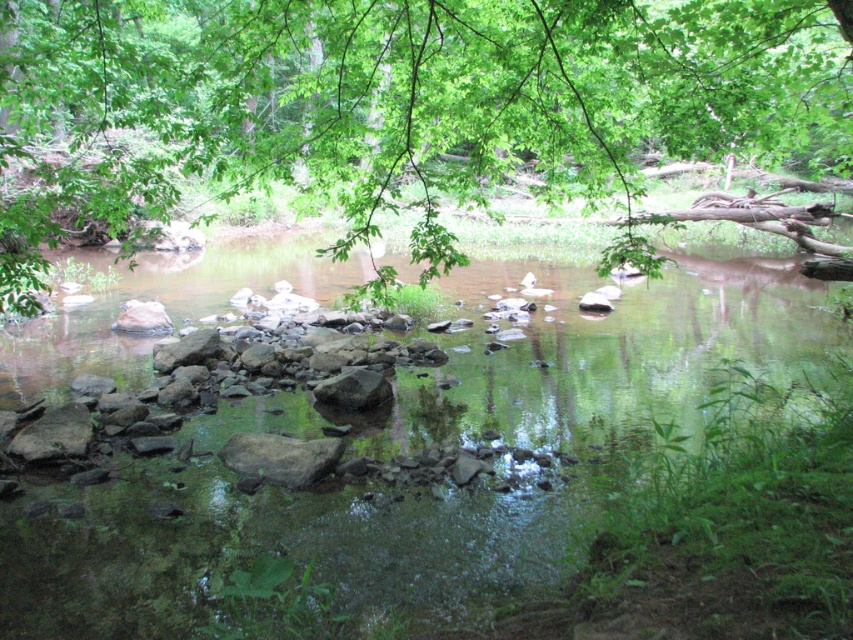
From the picture: You are a hiker standing at the edge of the stream. You notice a green leafy branch at upper center and a smooth gray rock at center. Which object is closer to you?

The smooth gray rock at center is closer to you since the green leafy branch at upper center is 5.72 meters away from it, meaning the branch is farther away from your position at the stream edge.